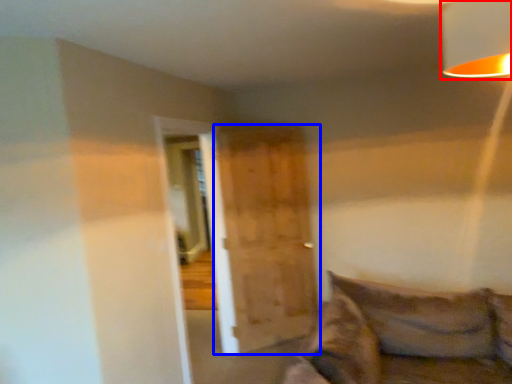
Question: Among these objects, which one is nearest to the camera, lamp (highlighted by a red box) or barn door (highlighted by a blue box)?

Choices:
 (A) lamp
 (B) barn door

Answer: (A)